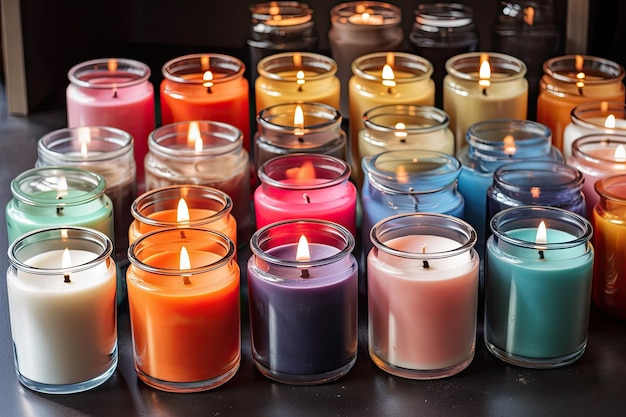
Locate an element on the screen. The height and width of the screenshot is (417, 626). yellow candles is located at coordinates (428, 138), (480, 94), (421, 87), (321, 90).